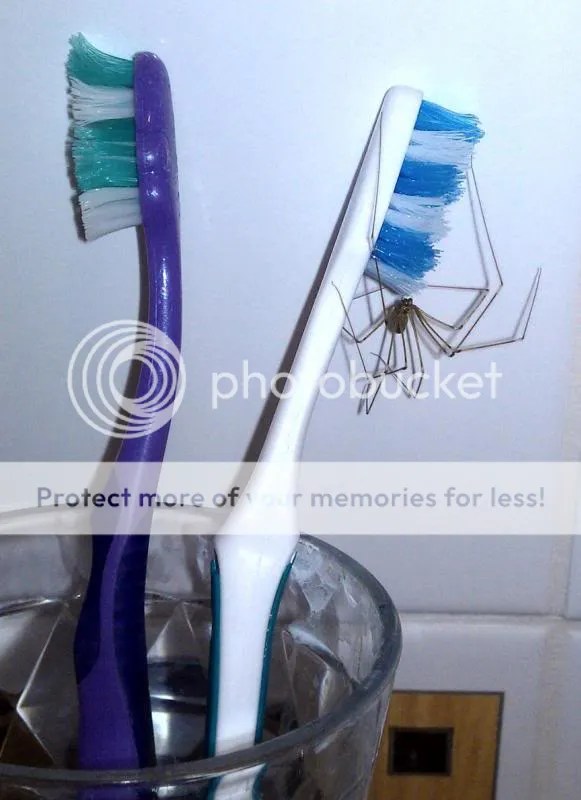
You are a GUI agent. You are given a task and a screenshot of the screen. Output one action in this format:
    pyautogui.click(x=<x>, y=<y>)
    Task: Click on the vent
    This screenshot has height=800, width=581.
    Given the screenshot: What is the action you would take?
    pyautogui.click(x=419, y=737)